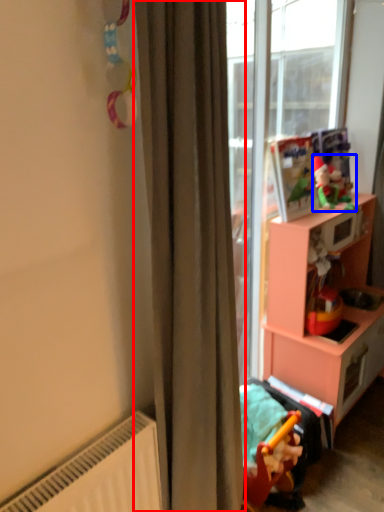
Question: Which of the following is the farthest to the observer, curtain (highlighted by a red box) or toy (highlighted by a blue box)?

Choices:
 (A) curtain
 (B) toy

Answer: (B)